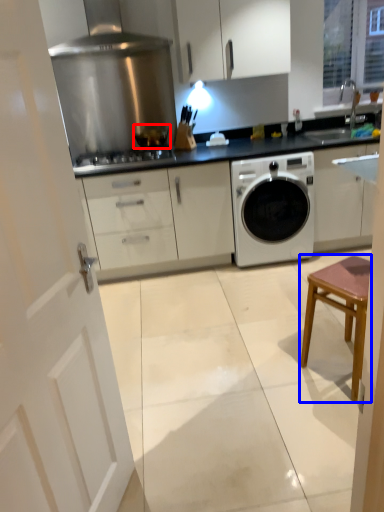
Question: Which object appears farthest to the camera in this image, kitchen appliance (highlighted by a red box) or stool (highlighted by a blue box)?

Choices:
 (A) kitchen appliance
 (B) stool

Answer: (A)